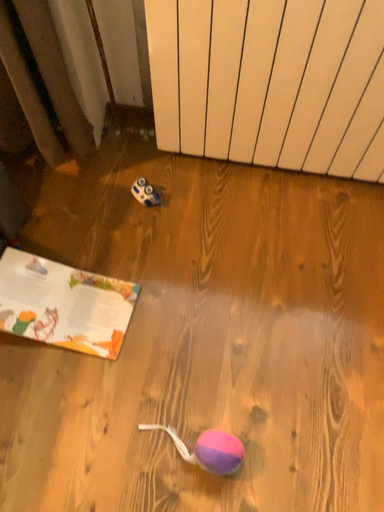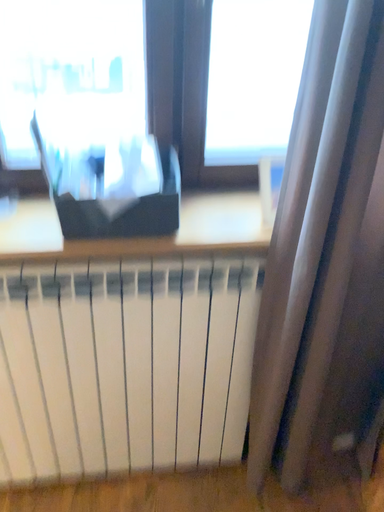
Question: Which way did the camera rotate in the video?

Choices:
 (A) rotated upward
 (B) rotated downward

Answer: (A)